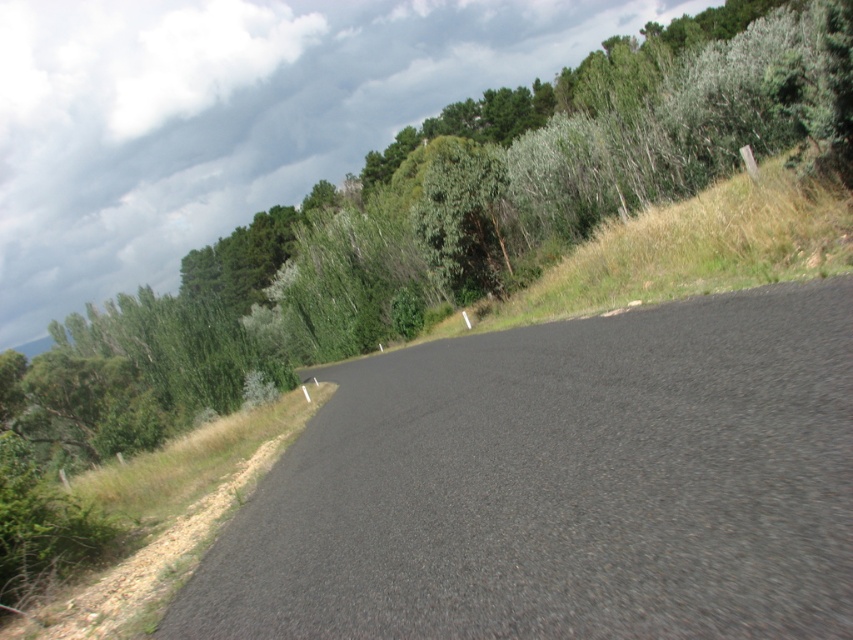
Question: Among these objects, which one is nearest to the camera?

Choices:
 (A) green leafy tree at upper left
 (B) black asphalt road at center

Answer: (B)

Question: Which object is farther from the camera taking this photo?

Choices:
 (A) black asphalt road at center
 (B) green leafy tree at upper left

Answer: (B)

Question: Is black asphalt road at center above green leafy tree at upper left?

Choices:
 (A) no
 (B) yes

Answer: (A)

Question: Which point is farther to the camera?

Choices:
 (A) (227, 401)
 (B) (257, 625)

Answer: (A)

Question: Is black asphalt road at center bigger than green leafy tree at upper left?

Choices:
 (A) yes
 (B) no

Answer: (B)

Question: Can you confirm if black asphalt road at center is positioned to the left of green leafy tree at upper left?

Choices:
 (A) no
 (B) yes

Answer: (A)